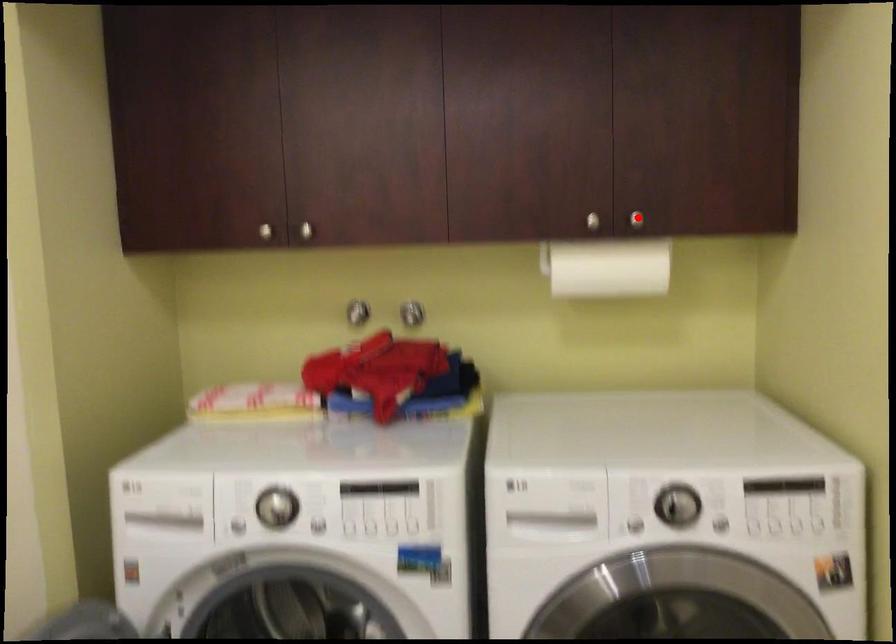
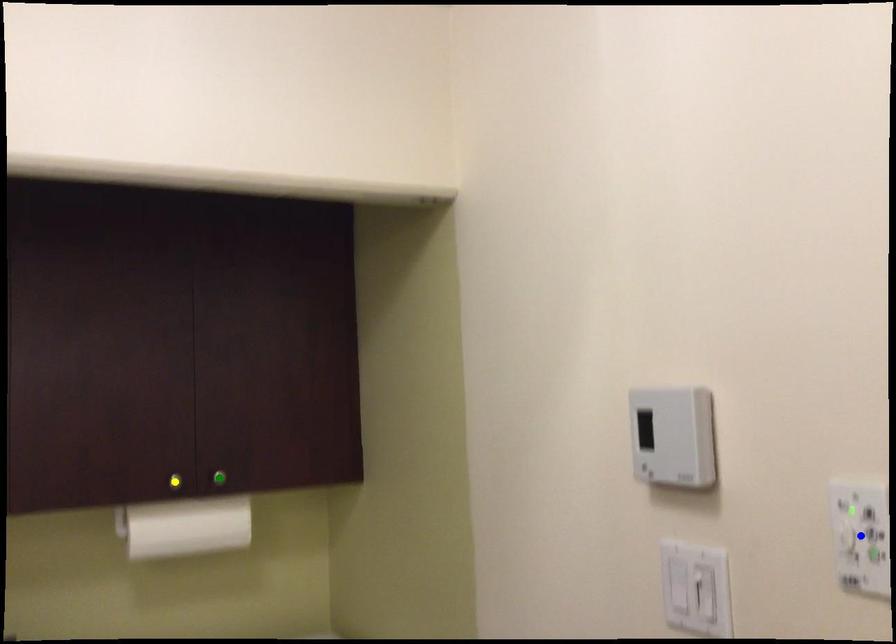
Question: I am providing you with two images of the same scene from different viewpoints. A red point is marked on the first image. You are given multiple points on the second image. Which point in image 2 represents the same 3d spot as the red point in image 1?

Choices:
 (A) blue point
 (B) yellow point
 (C) green point

Answer: (C)